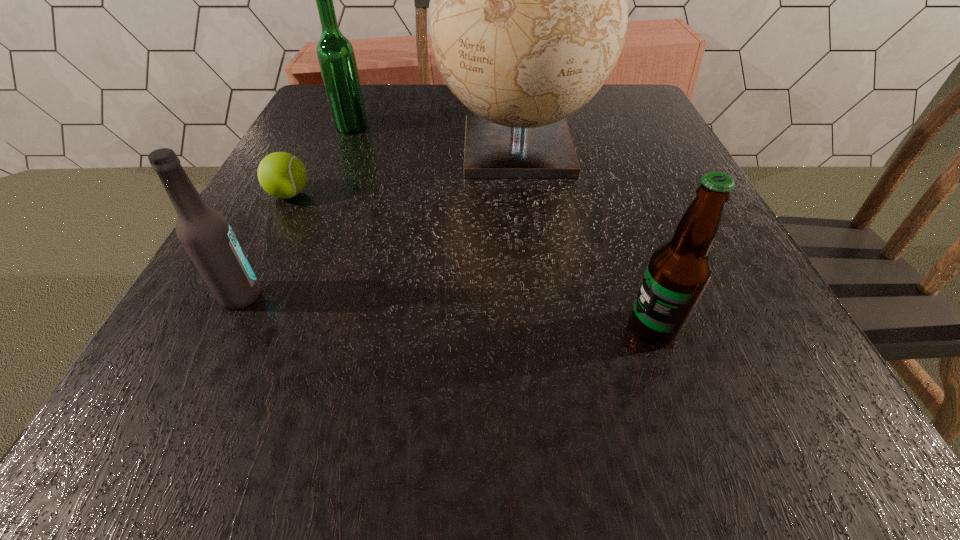
The image size is (960, 540). Identify the location of vacant space at the right edge. [x=647, y=142].

In the image, there is a desktop. Where is `free space at the far right corner`? Image resolution: width=960 pixels, height=540 pixels. free space at the far right corner is located at coordinates (607, 109).

Find the location of a particular element. free space between the globe and the shortest object is located at coordinates (403, 170).

At what (x,y) coordinates should I click in order to perform the action: click on vacant area that lies between the shortest object and the farthest beer bottle. Please return your answer as a coordinate pair (x, y). Looking at the image, I should click on (321, 160).

In order to click on free point between the globe and the tennis ball in this screenshot , I will do `click(403, 170)`.

Where is `free space between the rightmost beer bottle and the globe`? The image size is (960, 540). free space between the rightmost beer bottle and the globe is located at coordinates (586, 237).

Locate an element on the screen. vacant space that is in between the rightmost beer bottle and the tallest object is located at coordinates (586, 237).

The width and height of the screenshot is (960, 540). What are the coordinates of `vacant area between the farthest beer bottle and the rightmost beer bottle` in the screenshot? It's located at (502, 227).

In order to click on object that is the third nearest to the rightmost beer bottle in this screenshot , I will do `click(282, 175)`.

Find the location of a particular element. Image resolution: width=960 pixels, height=540 pixels. the second closest object relative to the rightmost beer bottle is located at coordinates (205, 234).